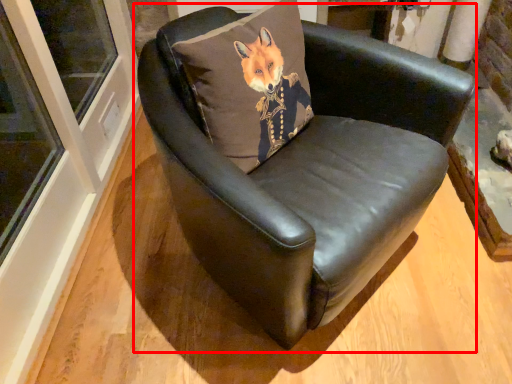
Question: Where is chair (annotated by the red box) located in relation to pillow in the image?

Choices:
 (A) right
 (B) left

Answer: (A)